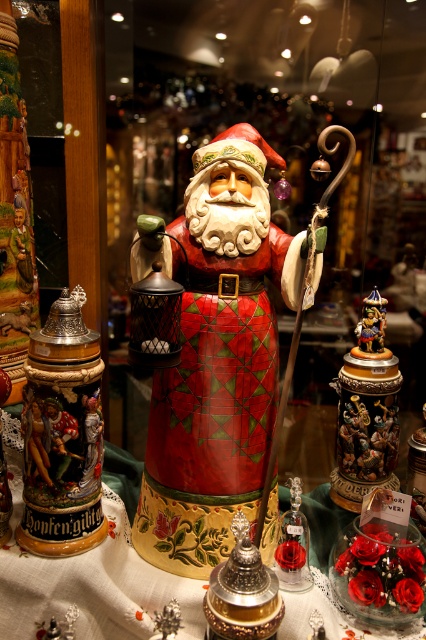
Is matte ceramic santa at center in front of gold metallic carousel at right?

That is True.

Can you confirm if matte ceramic santa at center is positioned above gold metallic carousel at right?

Yes, matte ceramic santa at center is above gold metallic carousel at right.

Is point (244, 160) less distant than point (385, 417)?

Yes.

What are the coordinates of `matte ceramic santa at center` in the screenshot? It's located at (215, 355).

Between point (161, 580) and point (302, 538), which one is positioned behind?

The point (302, 538) is more distant.

Does point (17, 556) come behind point (290, 493)?

No, it is in front of (290, 493).

Identify the location of matte glass vase at center. This screenshot has height=640, width=426. (95, 588).

Does gold metallic stein at left appear under gold metallic carousel at right?

No.

Who is more distant from viewer, [55,444] or [376,468]?

Positioned behind is point [376,468].

In the scene shown: Who is more distant from viewer, (x=71, y=493) or (x=356, y=356)?

Positioned behind is point (x=356, y=356).

The height and width of the screenshot is (640, 426). What are the coordinates of `gold metallic stein at left` in the screenshot? It's located at (62, 435).